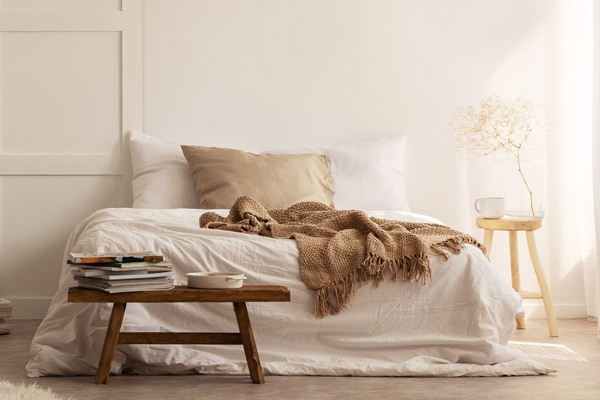
Image resolution: width=600 pixels, height=400 pixels. I want to click on bed sheet, so click(308, 315).